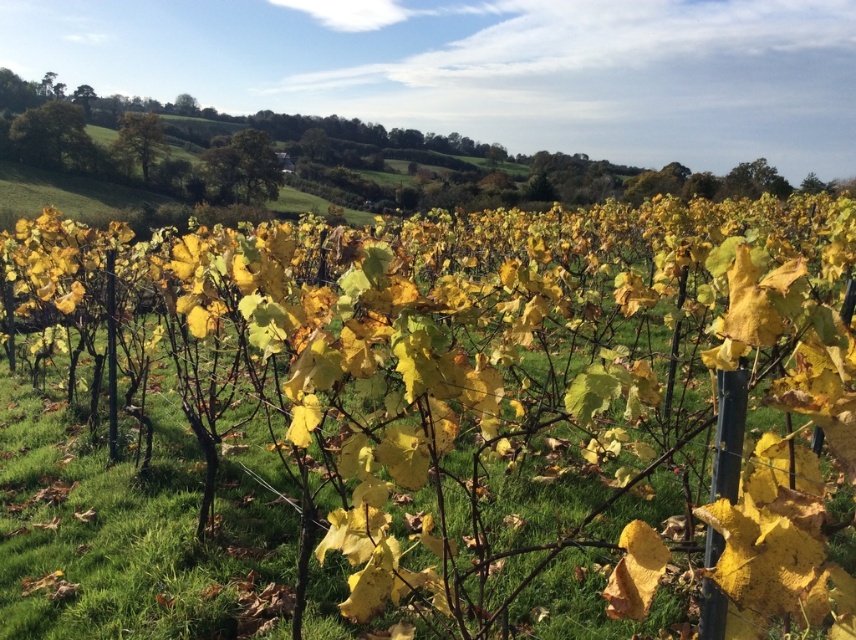
Is green leafy tree at upper left shorter than golden-brown bark tree at upper left?

Indeed, green leafy tree at upper left has a lesser height compared to golden-brown bark tree at upper left.

Where is `green leafy tree at upper left`? This screenshot has height=640, width=856. green leafy tree at upper left is located at coordinates (52, 136).

Where is `green leafy tree at upper left`? The width and height of the screenshot is (856, 640). green leafy tree at upper left is located at coordinates (52, 136).

Who is positioned more to the right, green leafy tree at upper center or golden-brown bark tree at upper left?

green leafy tree at upper center is more to the right.

Can you confirm if green leafy tree at upper center is smaller than golden-brown bark tree at upper left?

Incorrect, green leafy tree at upper center is not smaller in size than golden-brown bark tree at upper left.

I want to click on green leafy tree at upper center, so click(x=242, y=168).

The image size is (856, 640). What are the coordinates of `green leafy tree at upper center` in the screenshot? It's located at (242, 168).

Identify the location of golden-brown bark tree at upper left. This screenshot has width=856, height=640. (138, 140).

Is golden-brown bark tree at upper left shorter than green leafy tree at upper right?

Yes, golden-brown bark tree at upper left is shorter than green leafy tree at upper right.

This screenshot has height=640, width=856. I want to click on golden-brown bark tree at upper left, so click(138, 140).

Identify the location of golden-brown bark tree at upper left. The width and height of the screenshot is (856, 640). (138, 140).